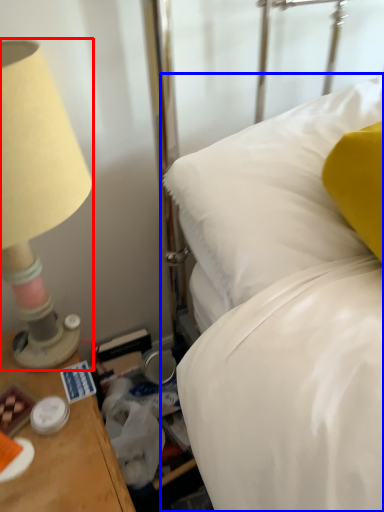
Question: Which point is further to the camera, lamp (highlighted by a red box) or bed (highlighted by a blue box)?

Choices:
 (A) lamp
 (B) bed

Answer: (B)